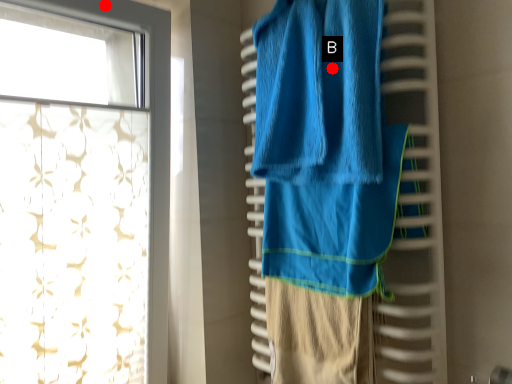
Question: Two points are circled on the image, labeled by A and B beside each circle. Among these points, which one is nearest to the camera?

Choices:
 (A) A is closer
 (B) B is closer

Answer: (B)